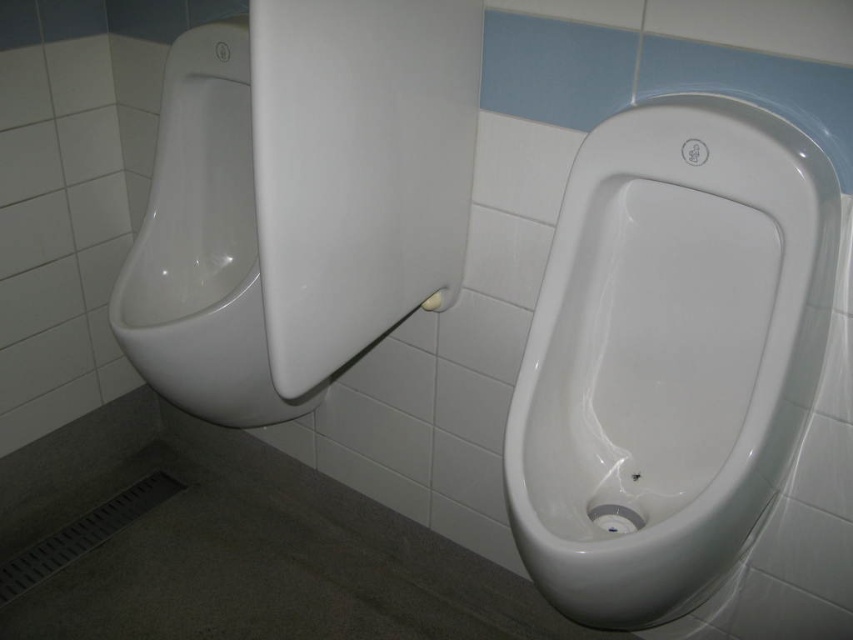
You are standing in a public restroom and need to use the urinal located at point (668, 355). The urinal you want to use is at that point. Which urinal should you approach?

The white glossy urinal at center is located at point (668, 355), so you should approach the white glossy urinal at center.

From the picture: You are a maintenance worker checking the urinals in the restroom. You need to replace the wider one between the white glossy urinal at center and the white glossy urinal at left. Which urinal should you replace?

The white glossy urinal at center should be replaced since it has a greater width than the white glossy urinal at left according to the description.

You are standing in a public restroom and need to locate two specific points marked on the floor. The first point is at coordinate point [637,554], and the second is at point [161,92]. Based on the restroom layout described, which point is closer to the tiled wall behind the urinals?

Point [637,554] is in front of point [161,92], so the point closer to the tiled wall behind the urinals is point [161,92].